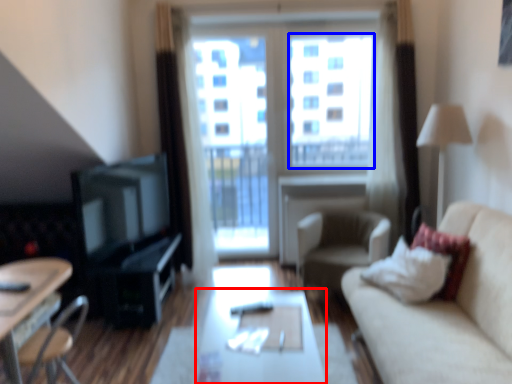
Question: Which object appears farthest to the camera in this image, table (highlighted by a red box) or window screen (highlighted by a blue box)?

Choices:
 (A) table
 (B) window screen

Answer: (B)